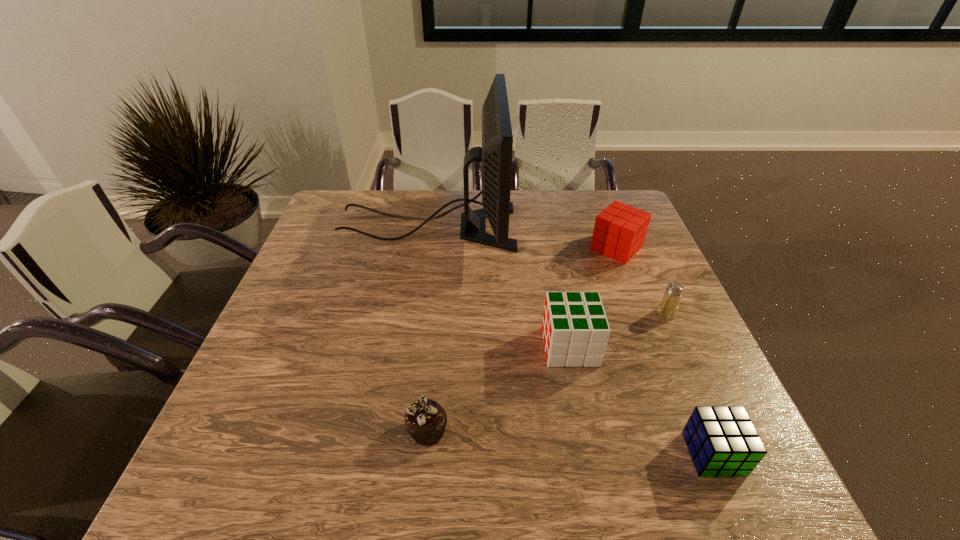
Where is `the tallest object`? The width and height of the screenshot is (960, 540). the tallest object is located at coordinates (495, 154).

In order to click on the second nearest cube in this screenshot , I will do `click(575, 329)`.

This screenshot has width=960, height=540. In order to click on the fourth farthest object in this screenshot , I will do `click(575, 329)`.

You are a GUI agent. You are given a task and a screenshot of the screen. Output one action in this format:
    pyautogui.click(x=<x>, y=<y>)
    Task: Click on the farthest cube
    The width and height of the screenshot is (960, 540).
    Given the screenshot: What is the action you would take?
    pyautogui.click(x=620, y=230)

Locate an element on the screen. saltshaker is located at coordinates (669, 304).

The image size is (960, 540). What are the coordinates of `the shortest cube` in the screenshot? It's located at (722, 441).

Image resolution: width=960 pixels, height=540 pixels. I want to click on cupcake, so point(425,420).

You are a GUI agent. You are given a task and a screenshot of the screen. Output one action in this format:
    pyautogui.click(x=<x>, y=<y>)
    Task: Click on the vacant area situated on the screen side of the tallest object
    The height and width of the screenshot is (540, 960).
    Given the screenshot: What is the action you would take?
    pyautogui.click(x=609, y=227)

Find the location of a particular element. This screenshot has width=960, height=540. vacant space located on the red face of the third object from left to right is located at coordinates (517, 347).

Where is `free region located on the red face of the third object from left to right`? The width and height of the screenshot is (960, 540). free region located on the red face of the third object from left to right is located at coordinates (451, 347).